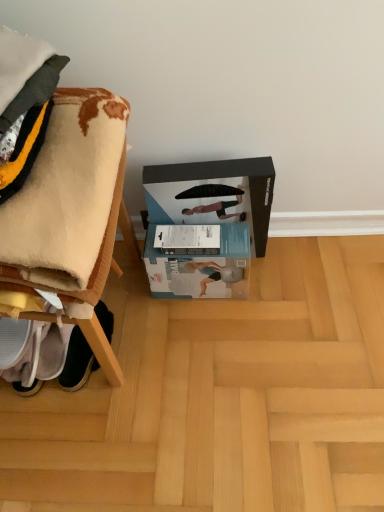
Locate an element on the screen. The image size is (384, 512). vacant space that's between white cardboard box at center and white fabric shoe at lower left is located at coordinates tap(157, 319).